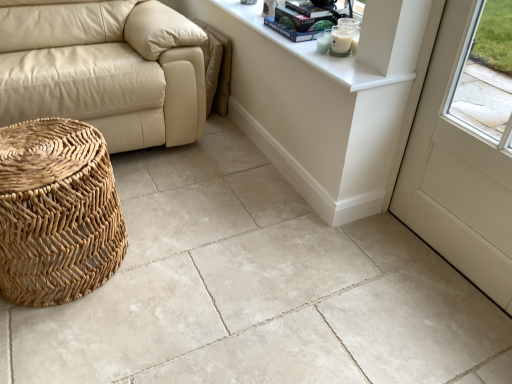
This screenshot has height=384, width=512. What are the coordinates of `vacant space in front of white glass candle at upper right` in the screenshot? It's located at (349, 74).